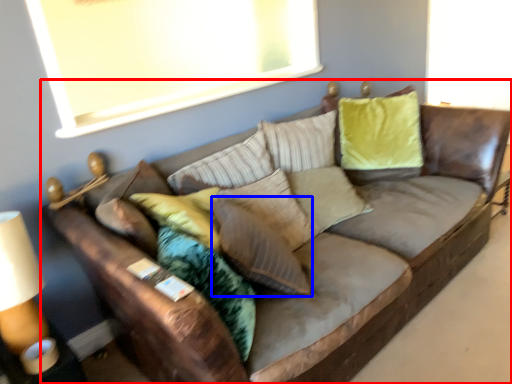
Question: Among these objects, which one is farthest to the camera, studio couch (highlighted by a red box) or pillow (highlighted by a blue box)?

Choices:
 (A) studio couch
 (B) pillow

Answer: (B)